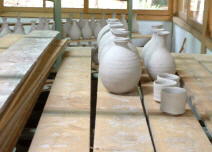
Where is `window frame`? This screenshot has height=152, width=212. window frame is located at coordinates point(179,20), point(169,5), point(150,12), point(206,10), point(106,10), point(85,2), point(36,10), point(2,3).